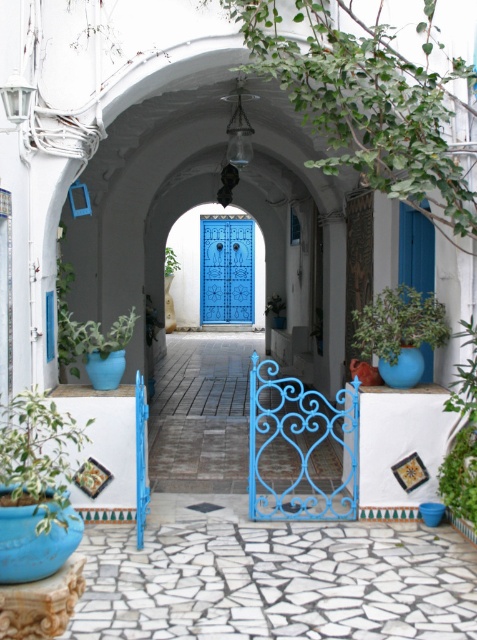
Question: Can you confirm if blue painted wood door at center is bigger than green matte plant at lower right?

Choices:
 (A) yes
 (B) no

Answer: (A)

Question: Among these objects, which one is nearest to the camera?

Choices:
 (A) green matte plant at lower right
 (B) matte blue pot at lower left
 (C) green leafy plant at lower left
 (D) green leafy plant at right

Answer: (C)

Question: Where is green matte plant at lower right located in relation to matte blue pot at lower left in the image?

Choices:
 (A) right
 (B) left

Answer: (A)

Question: Which object is positioned closest to the matte blue pot at lower left?

Choices:
 (A) blue painted wood door at center
 (B) green leafy plant at center

Answer: (B)

Question: Among these points, which one is nearest to the camera?

Choices:
 (A) (206, 310)
 (B) (20, 476)
 (C) (131, 324)
 (D) (423, 246)

Answer: (B)

Question: Does blue painted wood door at center lie in front of green leafy plant at center?

Choices:
 (A) yes
 (B) no

Answer: (B)